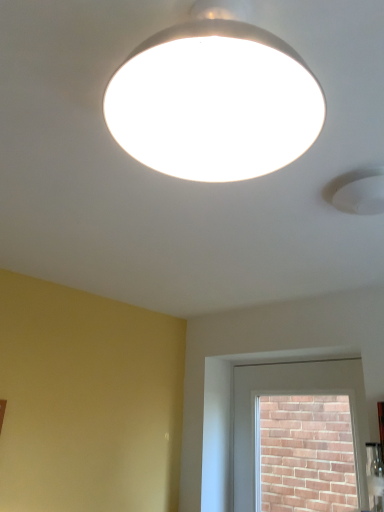
Question: Is white matte lamp at upper center not close to brick at upper center?

Choices:
 (A) no
 (B) yes

Answer: (B)

Question: Could you tell me if white matte lamp at upper center is facing brick at upper center?

Choices:
 (A) no
 (B) yes

Answer: (A)

Question: Does white matte lamp at upper center have a lesser width compared to brick at upper center?

Choices:
 (A) no
 (B) yes

Answer: (A)

Question: Is white matte lamp at upper center bigger than brick at upper center?

Choices:
 (A) no
 (B) yes

Answer: (A)

Question: Considering the relative positions of white matte lamp at upper center and brick at upper center in the image provided, is white matte lamp at upper center to the right of brick at upper center from the viewer's perspective?

Choices:
 (A) yes
 (B) no

Answer: (B)

Question: From a real-world perspective, is white matte lamp at upper center physically above brick at upper center?

Choices:
 (A) no
 (B) yes

Answer: (B)

Question: From a real-world perspective, does brick at upper center stand above white matte lamp at upper center?

Choices:
 (A) yes
 (B) no

Answer: (B)

Question: From the image's perspective, is brick at upper center located beneath white matte lamp at upper center?

Choices:
 (A) no
 (B) yes

Answer: (B)

Question: Does brick at upper center have a greater height compared to white matte lamp at upper center?

Choices:
 (A) yes
 (B) no

Answer: (A)

Question: Is brick at upper center oriented away from white matte lamp at upper center?

Choices:
 (A) yes
 (B) no

Answer: (B)

Question: Does brick at upper center lie in front of white matte lamp at upper center?

Choices:
 (A) yes
 (B) no

Answer: (B)

Question: From the image's perspective, would you say brick at upper center is positioned over white matte lamp at upper center?

Choices:
 (A) no
 (B) yes

Answer: (A)

Question: From a real-world perspective, is white matte lamp at upper center physically located above or below brick at upper center?

Choices:
 (A) above
 (B) below

Answer: (A)